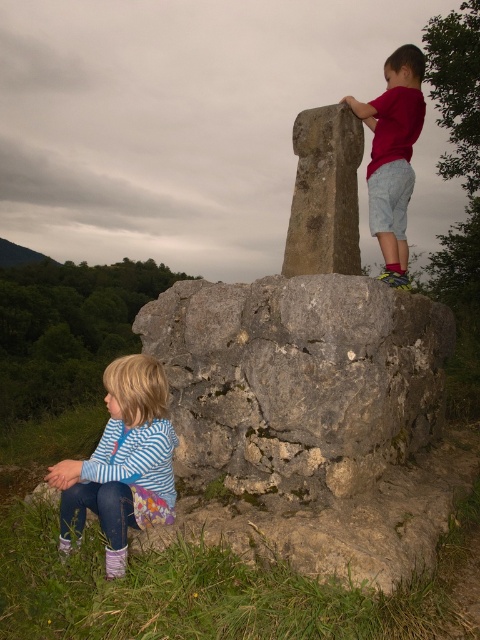
You are a photographer trying to capture a photo of both the striped fabric shirt at lower left and the red cotton shirt at upper right in the same frame. The minimum distance your camera can focus on two subjects is 2 meters. Will you be able to capture both in focus?

The striped fabric shirt at lower left is 2.01 meters away from the red cotton shirt at upper right. Since the distance is slightly over 2 meters, the camera might struggle to keep both in focus simultaneously. You may need to adjust your position or use a different lens setting to ensure both are sharp.